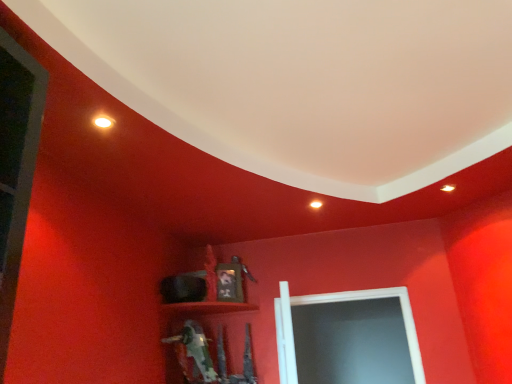
This screenshot has width=512, height=384. What do you see at coordinates (207, 307) in the screenshot?
I see `matte plastic shelf at center` at bounding box center [207, 307].

At what (x,y) coordinates should I click in order to perform the action: click on matte plastic shelf at center. Please return your answer as a coordinate pair (x, y). This screenshot has height=384, width=512. Looking at the image, I should click on (207, 307).

Where is `matte plastic shelf at center`? This screenshot has height=384, width=512. matte plastic shelf at center is located at coordinates (207, 307).